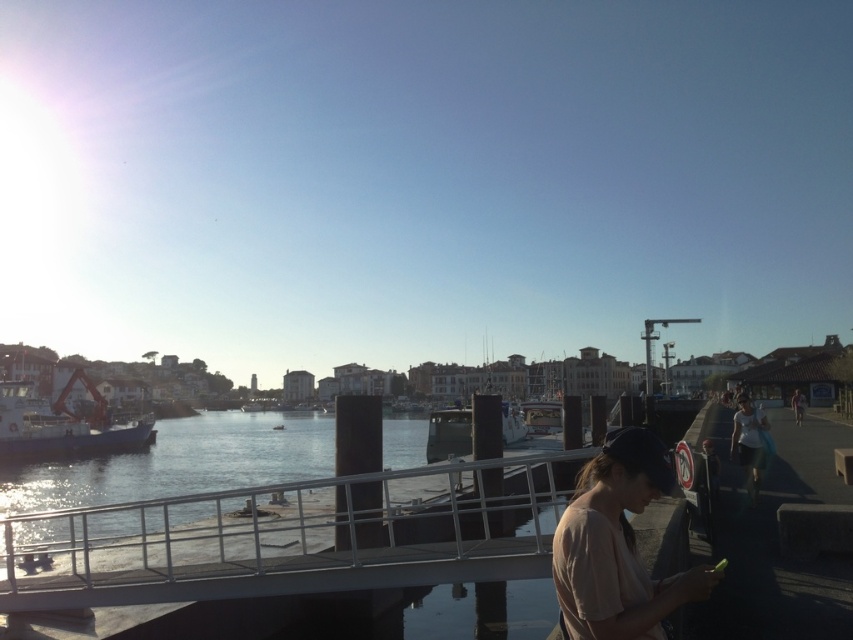
You are standing on the walkway and want to take a photo of both point (190, 554) and point (434, 444) in the scene. Which point should you focus on first to ensure both are in clear view?

You should focus on point (190, 554) first because it is closer to the camera than point (434, 444), ensuring both points are in focus.

You are standing on the walkway and want to take a photo of both the light brown cotton shirt at lower right and the blue matte boat at left. Which object should you focus on first to ensure both are in the frame?

You should focus on the light brown cotton shirt at lower right first because it is closer to the viewer than the blue matte boat at left, ensuring both are in the frame.